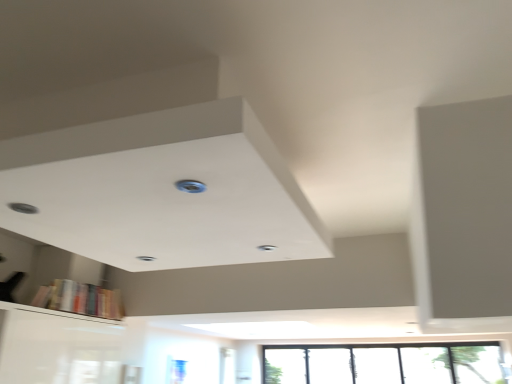
Question: Is blue plastic hole at center inside or outside of transparent glass window at lower right?

Choices:
 (A) inside
 (B) outside

Answer: (B)

Question: In the image, is blue plastic hole at center positioned in front of or behind transparent glass window at lower right?

Choices:
 (A) front
 (B) behind

Answer: (A)

Question: Which object is positioned closest to the transparent glass window at lower right?

Choices:
 (A) blue plastic hole at center
 (B) hardcover books at lower left

Answer: (B)

Question: Estimate the real-world distances between objects in this image. Which object is closer to the blue plastic hole at center?

Choices:
 (A) hardcover books at lower left
 (B) transparent glass window at lower right

Answer: (A)